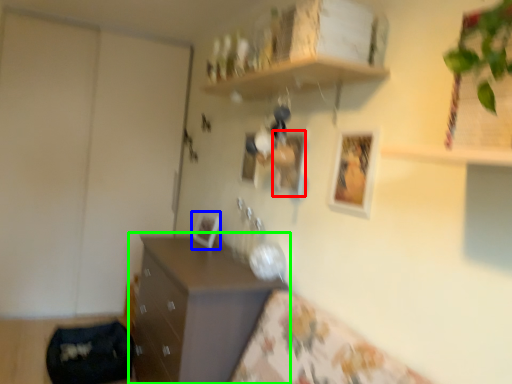
Question: Considering the real-world distances, which object is closest to picture frame (highlighted by a red box)? picture frame (highlighted by a blue box) or chest of drawers (highlighted by a green box).

Choices:
 (A) picture frame
 (B) chest of drawers

Answer: (A)